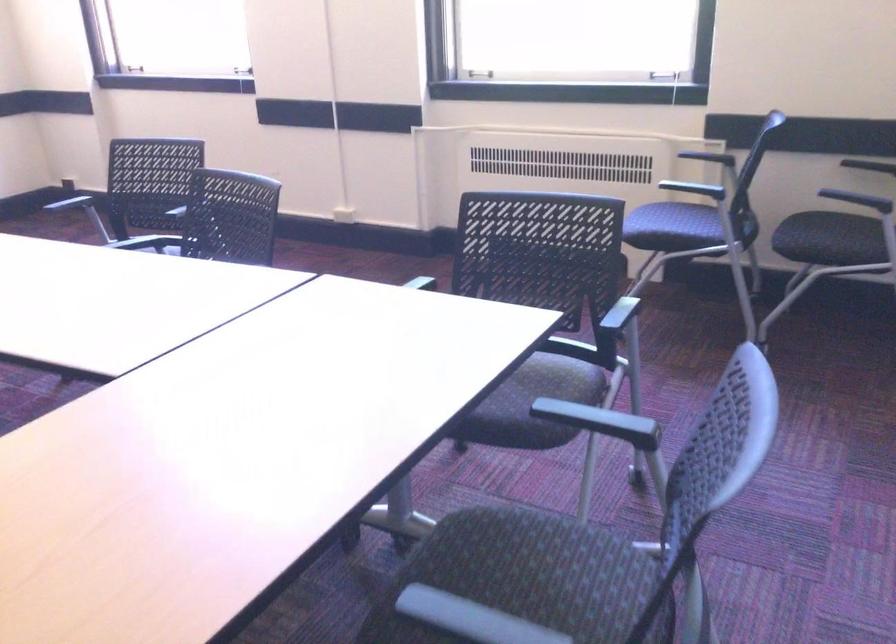
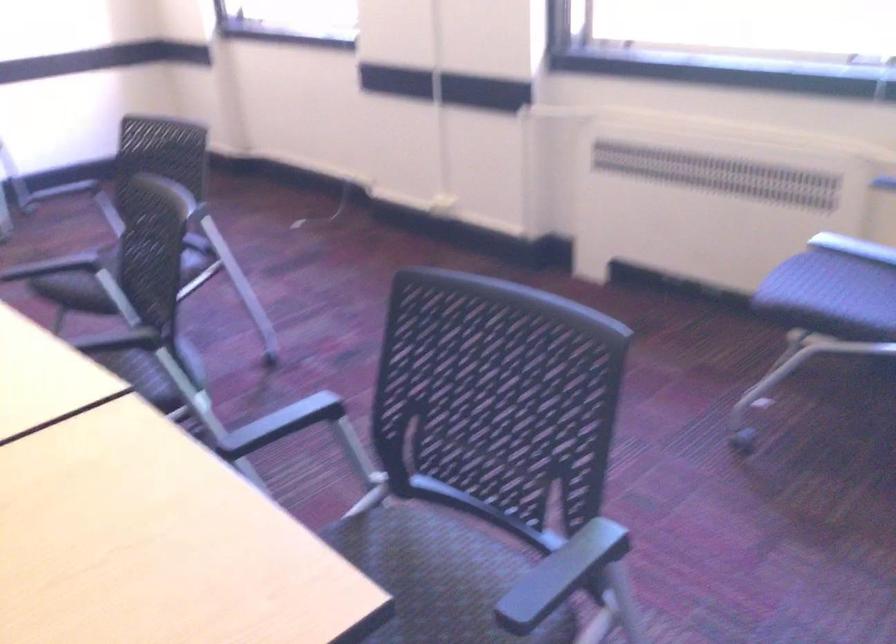
Question: Based on the continuous images, in which direction is the camera rotating? Reply with the corresponding letter.

Choices:
 (A) Left
 (B) Right
 (C) Up
 (D) Down

Answer: (A)